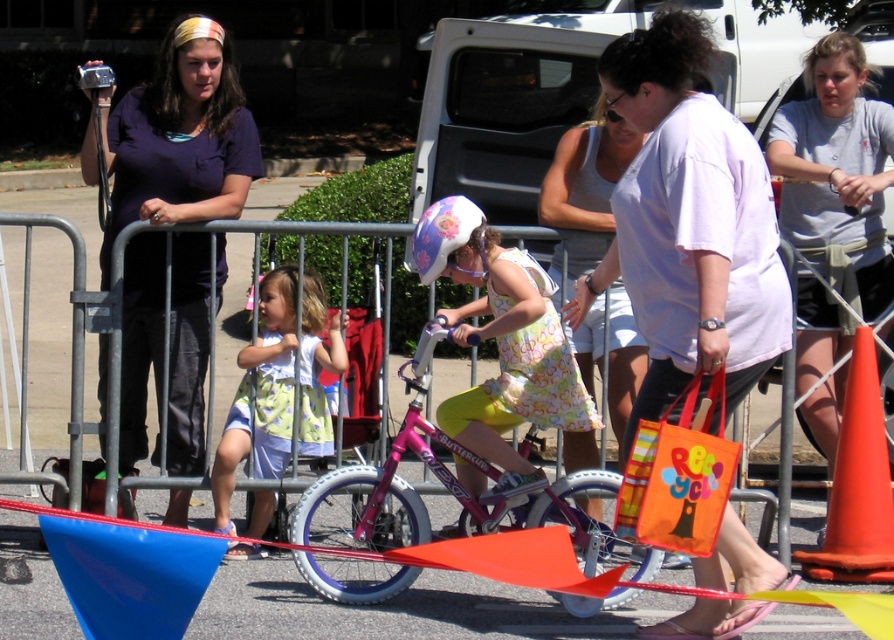
Question: Which point is farther to the camera?

Choices:
 (A) floral dress at center
 (B) light green floral dress at center
 (C) gray cotton t-shirt at upper right

Answer: (C)

Question: Is gray cotton t-shirt at upper right further to camera compared to floral dress at center?

Choices:
 (A) yes
 (B) no

Answer: (A)

Question: Which point appears closest to the camera in this image?

Choices:
 (A) (884, 241)
 (B) (462, 464)
 (C) (144, 289)
 (D) (630, 148)

Answer: (B)

Question: Is matte purple shirt at upper left to the right of orange plastic cone at center-right from the viewer's perspective?

Choices:
 (A) yes
 (B) no

Answer: (B)

Question: Does gray cotton t-shirt at upper right have a lesser width compared to pink metallic bicycle at center?

Choices:
 (A) no
 (B) yes

Answer: (B)

Question: Among these objects, which one is farthest from the camera?

Choices:
 (A) pink metallic bicycle at center
 (B) white cotton tank top at center
 (C) floral dress at center

Answer: (B)